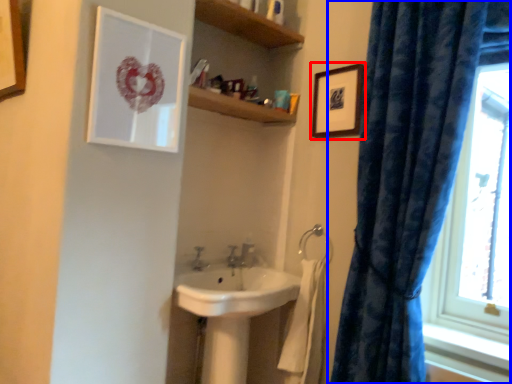
Question: Which object is further to the camera taking this photo, picture frame (highlighted by a red box) or curtain (highlighted by a blue box)?

Choices:
 (A) picture frame
 (B) curtain

Answer: (A)